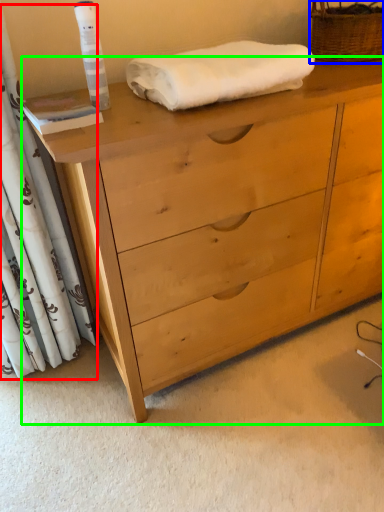
Question: Which object is positioned farthest from curtain (highlighted by a red box)? Select from basket (highlighted by a blue box) and chest of drawers (highlighted by a green box).

Choices:
 (A) basket
 (B) chest of drawers

Answer: (A)